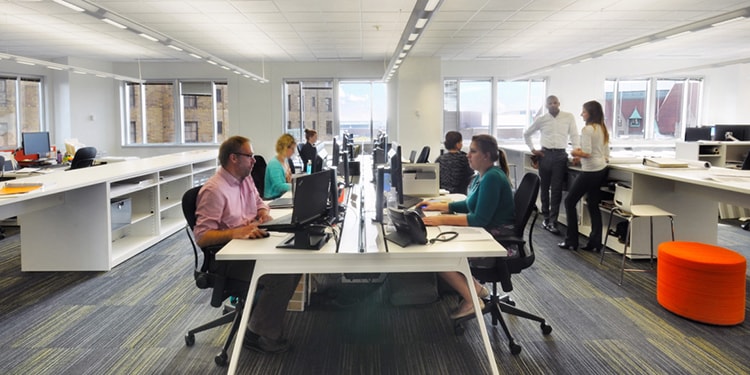
Locate an element on the screen. This screenshot has width=750, height=375. chairs is located at coordinates (652, 213), (694, 277), (526, 211), (424, 156), (414, 155), (261, 175), (189, 205), (300, 151), (292, 163).